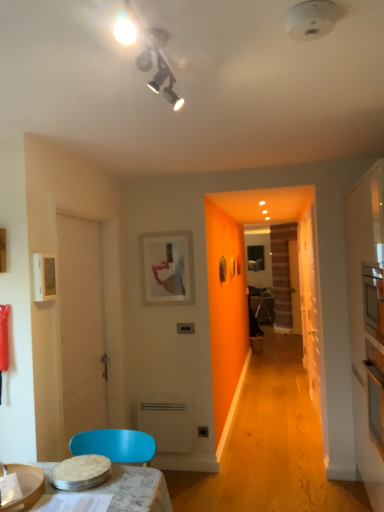
Question: Can you confirm if white glossy microwave at right is positioned to the left of white plastic radiator at lower center?

Choices:
 (A) yes
 (B) no

Answer: (B)

Question: From a real-world perspective, is white glossy microwave at right on white plastic radiator at lower center?

Choices:
 (A) yes
 (B) no

Answer: (A)

Question: Is there a large distance between white glossy microwave at right and white plastic radiator at lower center?

Choices:
 (A) no
 (B) yes

Answer: (B)

Question: Is white glossy microwave at right behind white plastic radiator at lower center?

Choices:
 (A) no
 (B) yes

Answer: (A)

Question: Considering the relative sizes of white glossy microwave at right and white plastic radiator at lower center in the image provided, is white glossy microwave at right thinner than white plastic radiator at lower center?

Choices:
 (A) no
 (B) yes

Answer: (A)

Question: Is transparent glass door at right wider or thinner than white matte door at left?

Choices:
 (A) wide
 (B) thin

Answer: (B)

Question: From the image's perspective, is transparent glass door at right positioned above or below white matte door at left?

Choices:
 (A) below
 (B) above

Answer: (A)

Question: Is transparent glass door at right inside the boundaries of white matte door at left, or outside?

Choices:
 (A) inside
 (B) outside

Answer: (B)

Question: From a real-world perspective, is transparent glass door at right positioned above or below white matte door at left?

Choices:
 (A) above
 (B) below

Answer: (B)

Question: In terms of size, does matte white picture frame at upper left, the 1th picture frame viewed from the front, appear bigger or smaller than transparent glass door at right?

Choices:
 (A) big
 (B) small

Answer: (B)

Question: Visually, is matte white picture frame at upper left, which is counted as the second picture frame, starting from the back, positioned to the left or to the right of transparent glass door at right?

Choices:
 (A) left
 (B) right

Answer: (A)

Question: From the image's perspective, is matte white picture frame at upper left, which is counted as the second picture frame, starting from the back, positioned above or below transparent glass door at right?

Choices:
 (A) below
 (B) above

Answer: (B)

Question: Choose the correct answer: Is matte white picture frame at upper left, the 1th picture frame viewed from the front, inside transparent glass door at right or outside it?

Choices:
 (A) inside
 (B) outside

Answer: (B)

Question: Relative to matte white picture frame at upper left, the 1th picture frame viewed from the front, is white plastic radiator at lower center in front or behind?

Choices:
 (A) behind
 (B) front

Answer: (A)

Question: Would you say white plastic radiator at lower center is to the left or to the right of matte white picture frame at upper left, which is counted as the second picture frame, starting from the right, in the picture?

Choices:
 (A) right
 (B) left

Answer: (A)